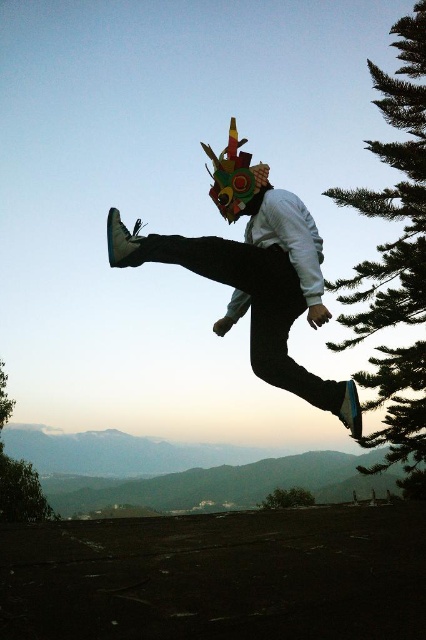
Is point (408, 88) positioned after point (0, 432)?

No.

The image size is (426, 640). What are the coordinates of `green textured pine tree at right` in the screenshot? It's located at (393, 195).

The image size is (426, 640). In order to click on green textured pine tree at right in this screenshot , I will do 393,195.

In the scene shown: Which is more to the left, green leafy tree at lower left or green matte tree at lower center?

From the viewer's perspective, green leafy tree at lower left appears more on the left side.

Is green leafy tree at lower left further to camera compared to green matte tree at lower center?

No, it is in front of green matte tree at lower center.

This screenshot has height=640, width=426. Identify the location of green leafy tree at lower left. (17, 476).

Between green textured pine tree at right and green matte tree at lower center, which one appears on the left side from the viewer's perspective?

green matte tree at lower center

Is point (382, 371) in front of point (267, 508)?

Yes, point (382, 371) is in front of point (267, 508).

The height and width of the screenshot is (640, 426). What are the coordinates of `green textured pine tree at right` in the screenshot? It's located at (393, 195).